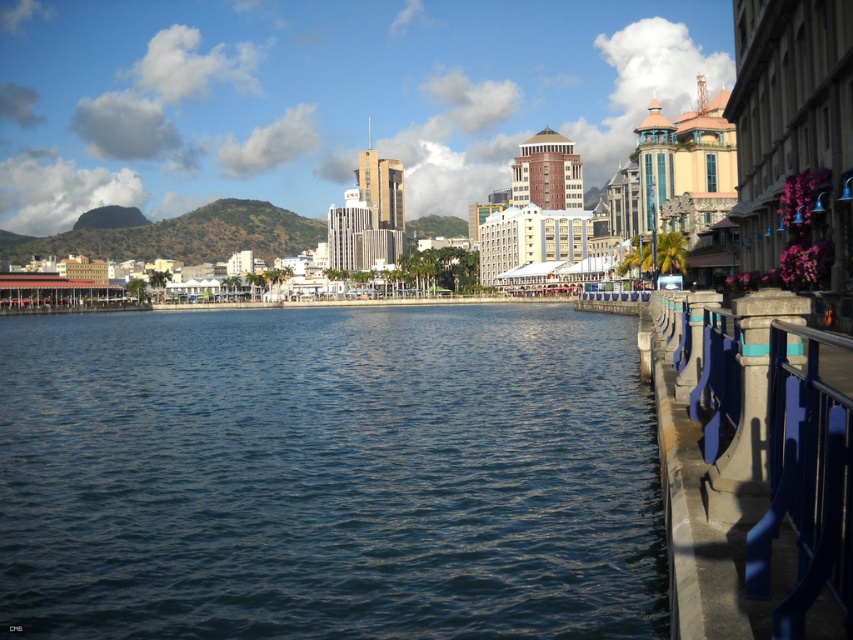
You are standing on the blue metallic railing at right and want to look at the blue water at center. Which object is higher from the ground?

The blue water at center is much taller than the blue metallic railing at right, so the blue water at center is higher from the ground.

You are a photographer planning to capture the waterfront scene. You want to ensure that both the blue water at center and the blue metallic railing at right are clearly visible in your shot. Given their sizes, which object should you focus on to ensure both are in frame without needing to adjust your camera angle?

The blue water at center is larger in size than the blue metallic railing at right, so focusing on the larger blue water at center will naturally include the smaller blue metallic railing at right in the frame without needing to adjust the camera angle.

Consider the image. You are standing on the blue metallic railing at right and want to look down to the blue water at center. In which direction should you look?

You should look downward because the blue water at center is below the blue metallic railing at right.